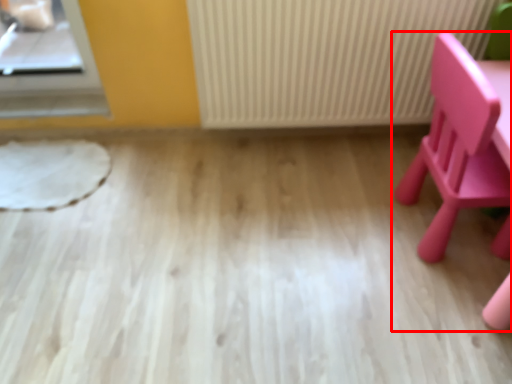
Question: From the image's perspective, where is chair (annotated by the red box) located relative to radiator?

Choices:
 (A) above
 (B) below

Answer: (B)